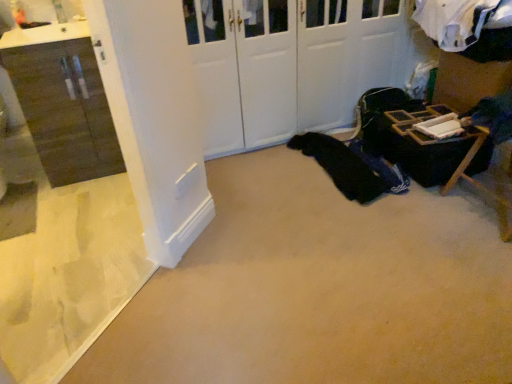
Question: Does matte brown cabinet at left have a greater width compared to white matte door at center?

Choices:
 (A) yes
 (B) no

Answer: (B)

Question: From a real-world perspective, does matte brown cabinet at left stand above white matte door at center?

Choices:
 (A) no
 (B) yes

Answer: (A)

Question: Does matte brown cabinet at left have a lesser width compared to white matte door at center?

Choices:
 (A) yes
 (B) no

Answer: (A)

Question: Is matte brown cabinet at left smaller than white matte door at center?

Choices:
 (A) yes
 (B) no

Answer: (A)

Question: Is matte brown cabinet at left positioned in front of white matte door at center?

Choices:
 (A) no
 (B) yes

Answer: (B)

Question: From the image's perspective, is matte brown cabinet at left under white matte door at center?

Choices:
 (A) yes
 (B) no

Answer: (A)

Question: Is white matte door at center bigger than black fabric at center?

Choices:
 (A) yes
 (B) no

Answer: (A)

Question: Does white matte door at center have a smaller size compared to black fabric at center?

Choices:
 (A) yes
 (B) no

Answer: (B)

Question: Does white matte door at center have a lesser height compared to black fabric at center?

Choices:
 (A) no
 (B) yes

Answer: (A)

Question: Is white matte door at center looking in the opposite direction of black fabric at center?

Choices:
 (A) yes
 (B) no

Answer: (B)

Question: Does white matte door at center lie behind black fabric at center?

Choices:
 (A) yes
 (B) no

Answer: (B)

Question: Could black fabric at center be considered to be inside white matte door at center?

Choices:
 (A) no
 (B) yes

Answer: (A)

Question: Is matte brown cabinet at left oriented away from black fabric at center?

Choices:
 (A) yes
 (B) no

Answer: (B)